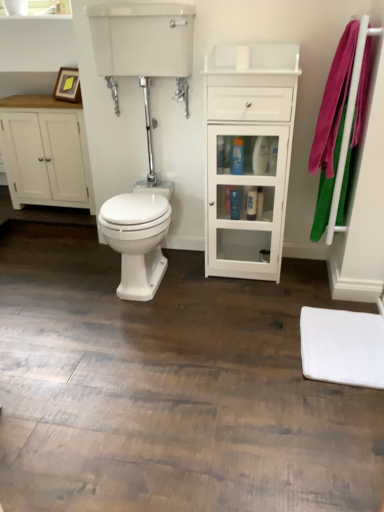
Where is `free location in front of white matte mat at lower right`? This screenshot has width=384, height=512. free location in front of white matte mat at lower right is located at coordinates (333, 418).